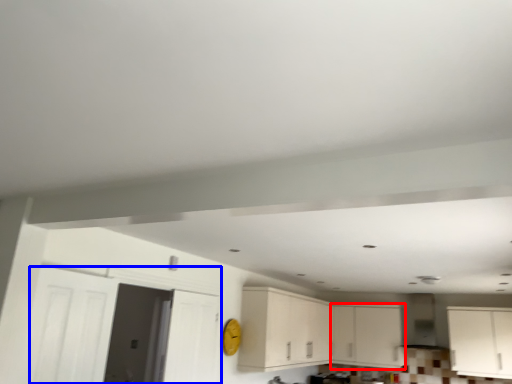
Question: Which of the following is the closest to the observer, cabinetry (highlighted by a red box) or door (highlighted by a blue box)?

Choices:
 (A) cabinetry
 (B) door

Answer: (B)